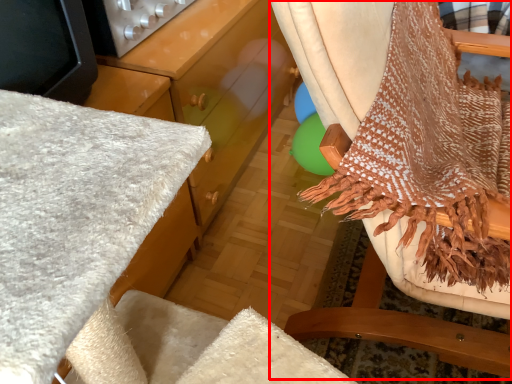
Question: In this image, where is chair (annotated by the red box) located relative to appliance?

Choices:
 (A) left
 (B) right

Answer: (B)